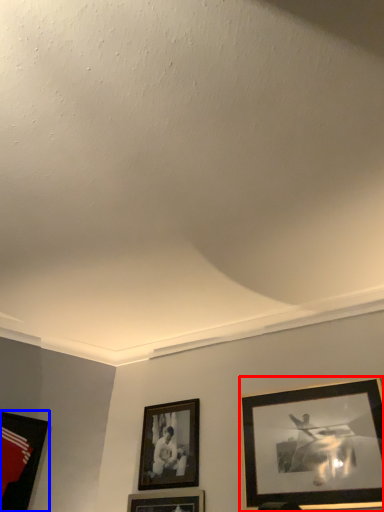
Question: Among these objects, which one is nearest to the camera, picture frame (highlighted by a red box) or picture frame (highlighted by a blue box)?

Choices:
 (A) picture frame
 (B) picture frame

Answer: (A)